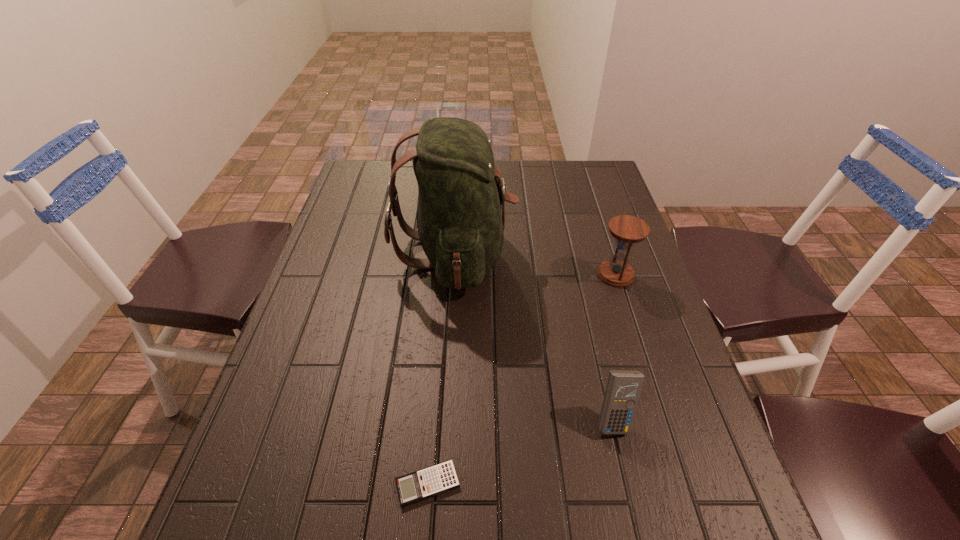
Find the location of `the tallest object`. the tallest object is located at coordinates (461, 196).

I want to click on the second tallest object, so click(x=627, y=230).

I want to click on hourglass, so click(x=627, y=230).

The width and height of the screenshot is (960, 540). In order to click on the taller calculator in this screenshot , I will do `click(623, 388)`.

Where is `the third farthest object`? the third farthest object is located at coordinates click(623, 388).

Where is `the shortest object`? The width and height of the screenshot is (960, 540). the shortest object is located at coordinates (440, 478).

In order to click on the nearest object in this screenshot , I will do `click(440, 478)`.

Image resolution: width=960 pixels, height=540 pixels. In order to click on vacant space located on the open flap of the tallest object in this screenshot , I will do `click(600, 253)`.

Where is `vacant space located on the front of the rightmost object`? vacant space located on the front of the rightmost object is located at coordinates (636, 336).

At what (x,y) coordinates should I click in order to perform the action: click on free space located 0.290m on the right of the shorter calculator. Please return your answer as a coordinate pair (x, y). The width and height of the screenshot is (960, 540). Looking at the image, I should click on (622, 484).